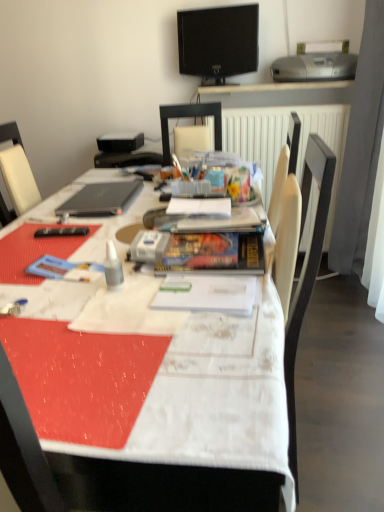
Question: Are sleek black laptop at upper left and white textured tablecloth at center located far from each other?

Choices:
 (A) no
 (B) yes

Answer: (A)

Question: Can you confirm if sleek black laptop at upper left is positioned to the left of white textured tablecloth at center?

Choices:
 (A) yes
 (B) no

Answer: (A)

Question: From the image's perspective, is sleek black laptop at upper left above white textured tablecloth at center?

Choices:
 (A) no
 (B) yes

Answer: (B)

Question: From a real-world perspective, is sleek black laptop at upper left located higher than white textured tablecloth at center?

Choices:
 (A) yes
 (B) no

Answer: (A)

Question: Is sleek black laptop at upper left shorter than white textured tablecloth at center?

Choices:
 (A) no
 (B) yes

Answer: (B)

Question: From a real-world perspective, is white textured tablecloth at center positioned above or below silver metallic printer at upper right?

Choices:
 (A) above
 (B) below

Answer: (B)

Question: From the image's perspective, is white textured tablecloth at center located above or below silver metallic printer at upper right?

Choices:
 (A) below
 (B) above

Answer: (A)

Question: In terms of size, does white textured tablecloth at center appear bigger or smaller than silver metallic printer at upper right?

Choices:
 (A) big
 (B) small

Answer: (A)

Question: Is white textured tablecloth at center taller or shorter than silver metallic printer at upper right?

Choices:
 (A) tall
 (B) short

Answer: (A)

Question: Visually, is white textured tablecloth at center positioned to the left or to the right of clear plastic bottle at center?

Choices:
 (A) left
 (B) right

Answer: (B)

Question: Relative to clear plastic bottle at center, is white textured tablecloth at center in front or behind?

Choices:
 (A) front
 (B) behind

Answer: (A)

Question: From a real-world perspective, relative to clear plastic bottle at center, is white textured tablecloth at center vertically above or below?

Choices:
 (A) above
 (B) below

Answer: (B)

Question: Looking at their shapes, would you say white textured tablecloth at center is wider or thinner than clear plastic bottle at center?

Choices:
 (A) wide
 (B) thin

Answer: (A)

Question: In the image, is matte black chair at center positioned in front of or behind sleek black laptop at upper left?

Choices:
 (A) behind
 (B) front

Answer: (A)

Question: Is point (201, 116) closer or farther from the camera than point (137, 186)?

Choices:
 (A) closer
 (B) farther

Answer: (B)